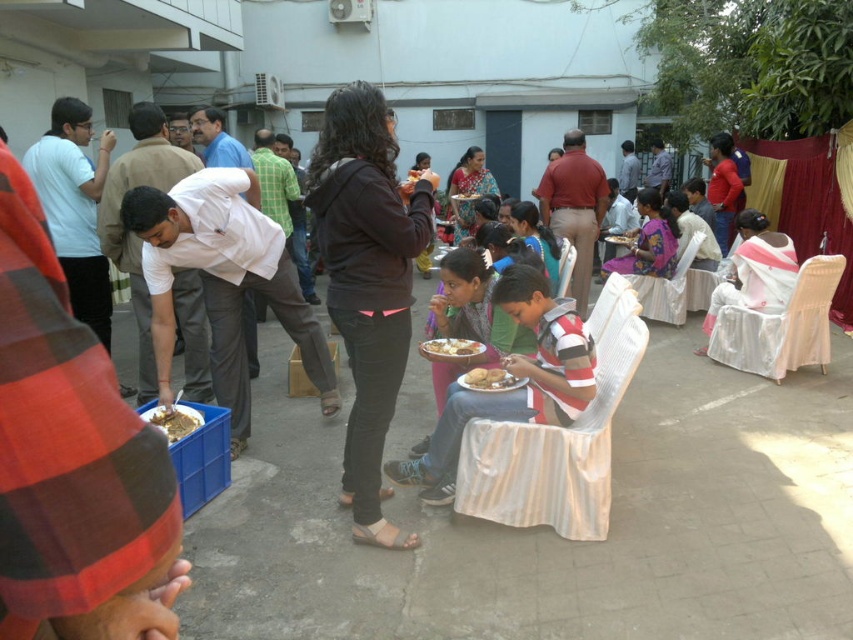
Question: Which object appears closest to the camera in this image?

Choices:
 (A) golden brown bread at center
 (B) dark brown leather jacket at center
 (C) shiny metallic tray at lower left
 (D) golden brown bread at lower center

Answer: (B)

Question: Among these points, which one is nearest to the camera?

Choices:
 (A) (422, 240)
 (B) (502, 387)
 (C) (451, 346)

Answer: (A)

Question: Can you confirm if striped cotton shirt at center is wider than golden brown bread at lower center?

Choices:
 (A) no
 (B) yes

Answer: (B)

Question: From the image, what is the correct spatial relationship of shiny metallic tray at lower left in relation to golden brown bread at center?

Choices:
 (A) left
 (B) right

Answer: (A)

Question: Which point is farther to the camera?

Choices:
 (A) (181, 426)
 (B) (477, 355)
 (C) (509, 384)
 (D) (563, 388)

Answer: (B)

Question: Is dark brown leather jacket at center smaller than shiny metallic tray at lower left?

Choices:
 (A) yes
 (B) no

Answer: (B)